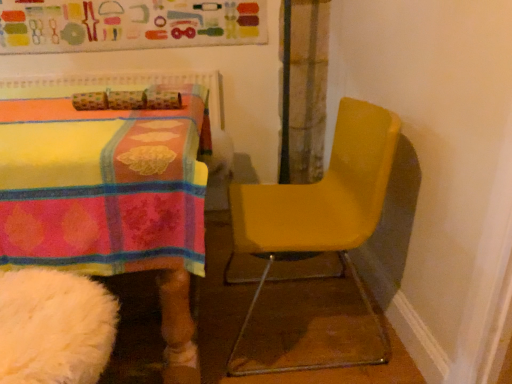
Question: Is yellow matte chair at right thinner than matte fabric bulletin board at upper center?

Choices:
 (A) yes
 (B) no

Answer: (B)

Question: Is yellow matte chair at right positioned far away from matte fabric bulletin board at upper center?

Choices:
 (A) no
 (B) yes

Answer: (B)

Question: Can we say yellow matte chair at right lies outside matte fabric bulletin board at upper center?

Choices:
 (A) yes
 (B) no

Answer: (A)

Question: Is yellow matte chair at right behind matte fabric bulletin board at upper center?

Choices:
 (A) yes
 (B) no

Answer: (B)

Question: Can you confirm if yellow matte chair at right is taller than matte fabric bulletin board at upper center?

Choices:
 (A) no
 (B) yes

Answer: (B)

Question: Does yellow matte chair at right have a lesser height compared to matte fabric bulletin board at upper center?

Choices:
 (A) no
 (B) yes

Answer: (A)

Question: From a real-world perspective, is matte fabric bulletin board at upper center over yellow matte chair at right?

Choices:
 (A) no
 (B) yes

Answer: (B)

Question: Is matte fabric bulletin board at upper center touching yellow matte chair at right?

Choices:
 (A) no
 (B) yes

Answer: (A)

Question: From the image's perspective, would you say matte fabric bulletin board at upper center is shown under yellow matte chair at right?

Choices:
 (A) yes
 (B) no

Answer: (B)

Question: From the image's perspective, is matte fabric bulletin board at upper center on top of yellow matte chair at right?

Choices:
 (A) yes
 (B) no

Answer: (A)

Question: Can you confirm if matte fabric bulletin board at upper center is shorter than yellow matte chair at right?

Choices:
 (A) no
 (B) yes

Answer: (B)

Question: Does matte fabric bulletin board at upper center have a smaller size compared to yellow matte chair at right?

Choices:
 (A) no
 (B) yes

Answer: (B)

Question: Considering the positions of matte fabric bulletin board at upper center and yellow matte chair at right in the image, is matte fabric bulletin board at upper center wider or thinner than yellow matte chair at right?

Choices:
 (A) thin
 (B) wide

Answer: (A)